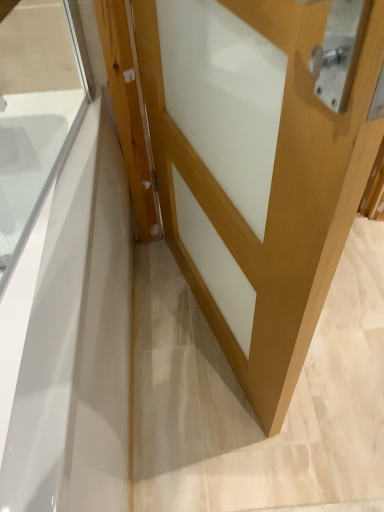
Where is `light brown wood door at center`? light brown wood door at center is located at coordinates [261, 163].

What do you see at coordinates (261, 163) in the screenshot? I see `light brown wood door at center` at bounding box center [261, 163].

In order to click on light brown wood door at center in this screenshot , I will do `click(261, 163)`.